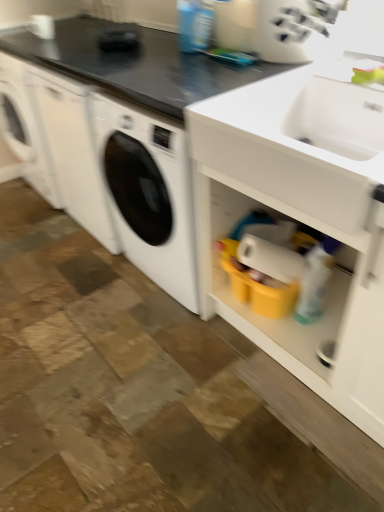
Identify the location of black matte countertop at upper center. The width and height of the screenshot is (384, 512). (137, 64).

Describe the element at coordinates (295, 29) in the screenshot. The height and width of the screenshot is (512, 384). I see `white plastic knife block at upper center` at that location.

Based on the photo, what is the approximate width of white plastic knife block at upper center?

white plastic knife block at upper center is 6.16 inches wide.

Find the location of a particular element. The image size is (384, 512). black matte countertop at upper center is located at coordinates (137, 64).

Locate an element on the screen. This screenshot has width=384, height=512. cabinetry below the white plastic knife block at upper center (from a real-world perspective) is located at coordinates (302, 217).

Is point (257, 35) closer or farther from the camera than point (308, 222)?

Point (257, 35).

Considering the sizes of white plastic knife block at upper center and white matte cabinet at lower right in the image, is white plastic knife block at upper center taller or shorter than white matte cabinet at lower right?

In the image, white plastic knife block at upper center appears to be shorter than white matte cabinet at lower right.

Considering the positions of objects white plastic knife block at upper center and white matte cabinet at lower right in the image provided, who is more to the left, white plastic knife block at upper center or white matte cabinet at lower right?

Positioned to the left is white plastic knife block at upper center.

Which object is further away from the camera, black matte countertop at upper center or white plastic knife block at upper center?

white plastic knife block at upper center is further away from the camera.

Is black matte countertop at upper center surrounding white plastic knife block at upper center?

Actually, white plastic knife block at upper center is outside black matte countertop at upper center.

Is black matte countertop at upper center far away from white plastic knife block at upper center?

No, black matte countertop at upper center is in close proximity to white plastic knife block at upper center.

Is white plastic knife block at upper center positioned with its back to black matte countertop at upper center?

No, white plastic knife block at upper center is not facing the opposite direction of black matte countertop at upper center.

Does white plastic knife block at upper center have a greater height compared to black matte countertop at upper center?

Correct, white plastic knife block at upper center is much taller as black matte countertop at upper center.

Is point (333, 26) closer or farther from the camera than point (3, 38)?

Clearly, point (333, 26) is closer to the camera than point (3, 38).

Can you tell me how much white matte cabinet at lower right and white plastic knife block at upper center differ in facing direction?

36.7 degrees separate the facing orientations of white matte cabinet at lower right and white plastic knife block at upper center.

From a real-world perspective, is white matte cabinet at lower right physically located above or below white plastic knife block at upper center?

Clearly, from a real-world perspective, white matte cabinet at lower right is below white plastic knife block at upper center.

In the scene shown: Is the position of white matte cabinet at lower right less distant than that of white plastic knife block at upper center?

Yes, the depth of white matte cabinet at lower right is less than that of white plastic knife block at upper center.

In terms of height, does white matte cabinet at lower right look taller or shorter compared to white plastic knife block at upper center?

Clearly, white matte cabinet at lower right is taller compared to white plastic knife block at upper center.

Considering the positions of objects black matte countertop at upper center and white matte cabinet at lower right in the image provided, who is more to the right, black matte countertop at upper center or white matte cabinet at lower right?

white matte cabinet at lower right.

Is white matte cabinet at lower right at the back of black matte countertop at upper center?

No, black matte countertop at upper center is not facing the opposite direction of white matte cabinet at lower right.

From a real-world perspective, which is physically above, black matte countertop at upper center or white matte cabinet at lower right?

black matte countertop at upper center.

Between white matte cabinet at lower right and black matte countertop at upper center, which one appears on the left side from the viewer's perspective?

black matte countertop at upper center.

Is white matte cabinet at lower right next to black matte countertop at upper center?

No.

Considering the relative sizes of white matte cabinet at lower right and black matte countertop at upper center in the image provided, is white matte cabinet at lower right bigger than black matte countertop at upper center?

Yes.

Can you confirm if white matte cabinet at lower right is wider than black matte countertop at upper center?

Yes.

Find the location of `appliance located above the white matte cabinet at lower right (from a real-world perspective)`. appliance located above the white matte cabinet at lower right (from a real-world perspective) is located at coordinates (295, 29).

Where is `appliance that is on the right side of black matte countertop at upper center`? The image size is (384, 512). appliance that is on the right side of black matte countertop at upper center is located at coordinates (295, 29).

Looking at the image, which one is located further to black matte countertop at upper center, white matte cabinet at lower right or white plastic knife block at upper center?

Based on the image, white matte cabinet at lower right appears to be further to black matte countertop at upper center.

From the image, which object appears to be nearer to white matte cabinet at lower right, white plastic knife block at upper center or black matte countertop at upper center?

Result: white plastic knife block at upper center is positioned closer to the anchor white matte cabinet at lower right.

Looking at the image, which one is located closer to white plastic knife block at upper center, white matte cabinet at lower right or black matte countertop at upper center?

black matte countertop at upper center is positioned closer to the anchor white plastic knife block at upper center.

Based on their spatial positions, is black matte countertop at upper center or white matte cabinet at lower right further from white plastic knife block at upper center?

white matte cabinet at lower right is positioned further to the anchor white plastic knife block at upper center.

Estimate the real-world distances between objects in this image. Which object is closer to black matte countertop at upper center, white plastic knife block at upper center or white matte cabinet at lower right?

white plastic knife block at upper center.

In the scene shown: When comparing their distances from white matte cabinet at lower right, does black matte countertop at upper center or white plastic knife block at upper center seem closer?

The object closer to white matte cabinet at lower right is white plastic knife block at upper center.

The height and width of the screenshot is (512, 384). In order to click on appliance between black matte countertop at upper center and white matte cabinet at lower right in the horizontal direction in this screenshot , I will do `click(295, 29)`.